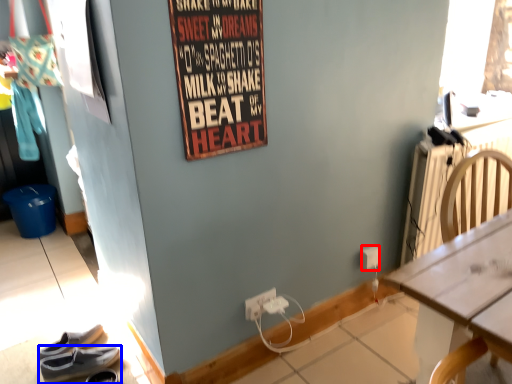
Question: Among these objects, which one is nearest to the camera, power outlet (highlighted by a red box) or footwear (highlighted by a blue box)?

Choices:
 (A) power outlet
 (B) footwear

Answer: (B)